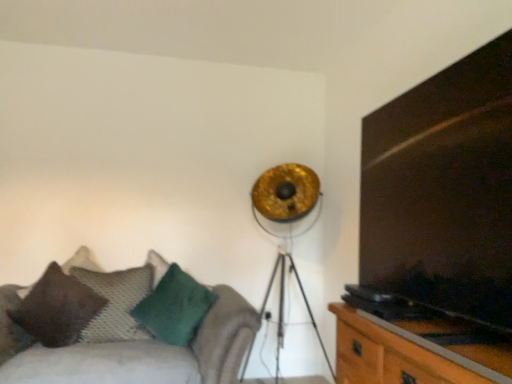
Question: From a real-world perspective, is dark wood entertainment center at right located beneath gold metallic tripod lamp at upper center?

Choices:
 (A) yes
 (B) no

Answer: (B)

Question: Is dark wood entertainment center at right not close to gold metallic tripod lamp at upper center?

Choices:
 (A) yes
 (B) no

Answer: (A)

Question: Is dark wood entertainment center at right oriented away from gold metallic tripod lamp at upper center?

Choices:
 (A) no
 (B) yes

Answer: (A)

Question: Does dark wood entertainment center at right have a greater height compared to gold metallic tripod lamp at upper center?

Choices:
 (A) yes
 (B) no

Answer: (B)

Question: Would you say gold metallic tripod lamp at upper center is part of dark wood entertainment center at right's contents?

Choices:
 (A) no
 (B) yes

Answer: (A)

Question: From a real-world perspective, is green fuzzy pillow at lower left, positioned as the 3th pillow in left-to-right order, positioned above or below wooden cabinet at right?

Choices:
 (A) above
 (B) below

Answer: (A)

Question: Based on their sizes in the image, would you say green fuzzy pillow at lower left, positioned as the 3th pillow in left-to-right order, is bigger or smaller than wooden cabinet at right?

Choices:
 (A) small
 (B) big

Answer: (A)

Question: Based on their positions, is green fuzzy pillow at lower left, the 1th pillow from the right, located to the left or right of wooden cabinet at right?

Choices:
 (A) right
 (B) left

Answer: (B)

Question: Is green fuzzy pillow at lower left, positioned as the 3th pillow in left-to-right order, in front of or behind wooden cabinet at right in the image?

Choices:
 (A) front
 (B) behind

Answer: (B)

Question: Which is correct: gold metallic tripod lamp at upper center is inside green fuzzy pillow at lower left, the 1th pillow from the right, or outside of it?

Choices:
 (A) outside
 (B) inside

Answer: (A)

Question: From a real-world perspective, relative to green fuzzy pillow at lower left, the 1th pillow from the right, is gold metallic tripod lamp at upper center vertically above or below?

Choices:
 (A) above
 (B) below

Answer: (A)

Question: Considering their positions, is gold metallic tripod lamp at upper center located in front of or behind green fuzzy pillow at lower left, the 1th pillow from the right?

Choices:
 (A) front
 (B) behind

Answer: (A)

Question: In terms of size, does gold metallic tripod lamp at upper center appear bigger or smaller than green fuzzy pillow at lower left, positioned as the 3th pillow in left-to-right order?

Choices:
 (A) small
 (B) big

Answer: (B)

Question: From a real-world perspective, is green fuzzy pillow at lower left, positioned as the 3th pillow in left-to-right order, positioned above or below gold metallic tripod lamp at upper center?

Choices:
 (A) above
 (B) below

Answer: (B)

Question: Is point (183, 312) closer or farther from the camera than point (290, 264)?

Choices:
 (A) farther
 (B) closer

Answer: (B)